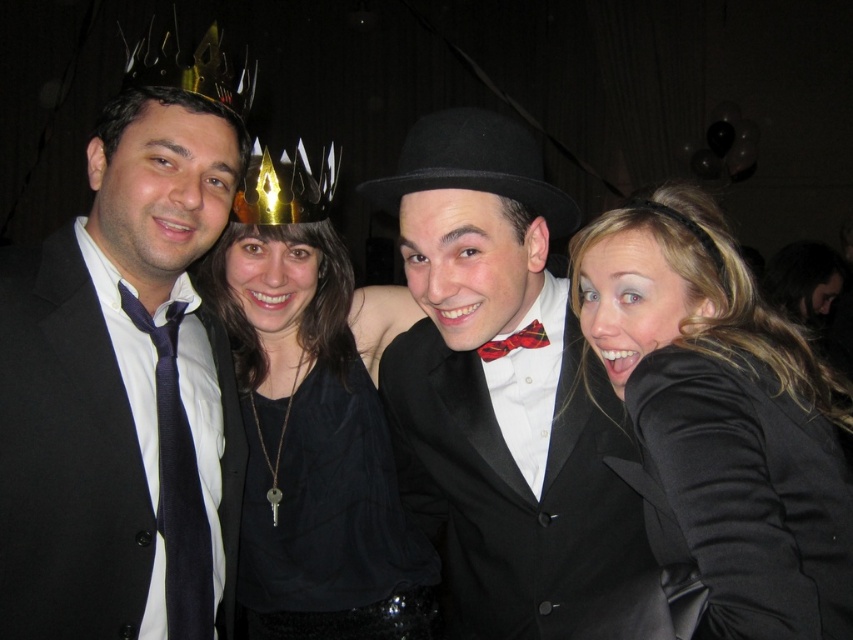
The height and width of the screenshot is (640, 853). What do you see at coordinates (500, 388) in the screenshot? I see `black satin bow tie at center` at bounding box center [500, 388].

Based on the photo, can you confirm if black satin bow tie at center is positioned to the right of matte black tie at left?

Yes, black satin bow tie at center is to the right of matte black tie at left.

The width and height of the screenshot is (853, 640). Identify the location of black satin bow tie at center. (500, 388).

Does point (262, 225) come farther from viewer compared to point (177, 388)?

Yes, point (262, 225) is behind point (177, 388).

Is black fabric shirt at center positioned at the back of matte black tie at left?

Yes, black fabric shirt at center is behind matte black tie at left.

Is point (355, 570) in front of point (199, 492)?

No, it is not.

Locate an element on the screen. black fabric shirt at center is located at coordinates (309, 424).

Is matte black suit at left behind plaid fabric bow tie at center?

No, it is not.

Locate an element on the screen. Image resolution: width=853 pixels, height=640 pixels. matte black suit at left is located at coordinates (71, 452).